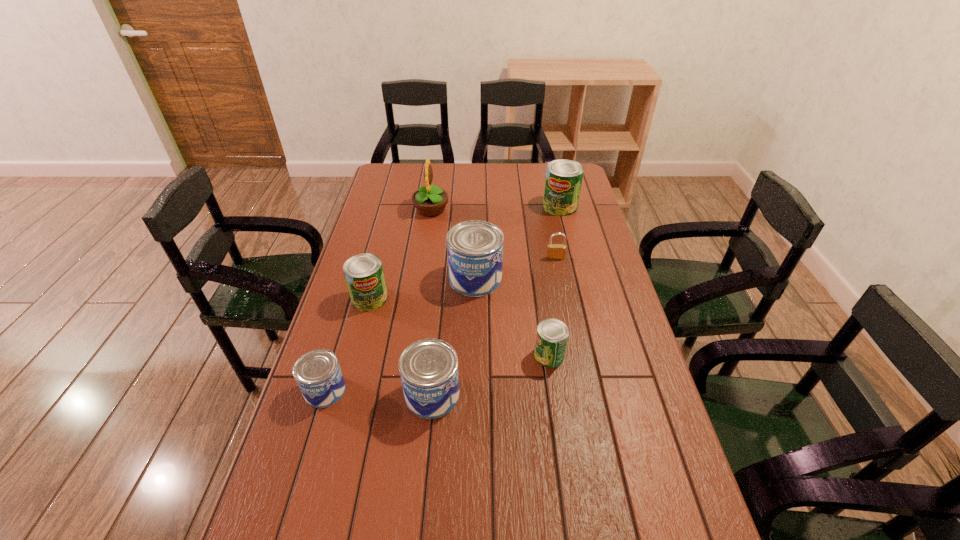
Find the location of a particular element. This screenshot has width=960, height=540. the smallest green can is located at coordinates (552, 335).

Identify the location of the sixth farthest object. This screenshot has height=540, width=960. (552, 335).

The image size is (960, 540). What are the coordinates of `the smallest blue can` in the screenshot? It's located at (318, 374).

Find the location of a particular element. This screenshot has width=960, height=540. vacant space located on the face of the sunflower is located at coordinates (513, 210).

Locate an element on the screen. vacant space located 0.050m on the right of the rightmost can is located at coordinates (589, 207).

You are a GUI agent. You are given a task and a screenshot of the screen. Output one action in this format:
    pyautogui.click(x=<x>, y=<y>)
    Task: Click on the vacant space situated on the front label of the biggest blue can
    
    Given the screenshot: What is the action you would take?
    pyautogui.click(x=555, y=279)

Identify the location of free space located on the front of the second smallest green can. The image size is (960, 540). (337, 425).

The image size is (960, 540). I want to click on vacant region located on the front label of the second biggest blue can, so click(x=493, y=395).

Identify the location of free space located on the front-facing side of the brass padlock. (563, 293).

Locate an element on the screen. The width and height of the screenshot is (960, 540). free spot located on the front of the second green can from right to left is located at coordinates (570, 503).